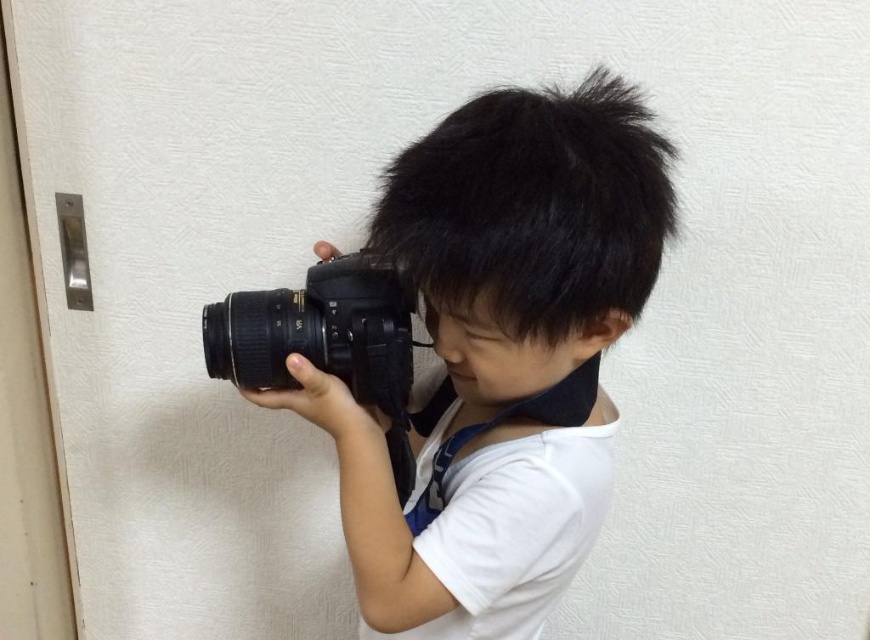
You are a photographer trying to decide which camera to use for a close portrait. The scene has a matte black camera at center and a black rubberized camera at center. Which camera is positioned closer to the photographer?

The matte black camera at center is closer to the photographer than the black rubberized camera at center.

You are a photographer trying to determine which of the two points, point (x=524, y=307) or point (x=280, y=316), is nearer to the camera lens in the scene. Which point is closer?

Point (x=524, y=307) is closer to the camera than point (x=280, y=316).

You are a photographer trying to set up a tripod for your matte black camera at center. The tripod requires a minimum of 24 inches between the camera and the support point. Can you place the tripod in this setup?

The matte black camera at center and camera are 26.57 inches apart from each other, which exceeds the minimum requirement of 24 inches. Therefore, the tripod can be placed in this setup.